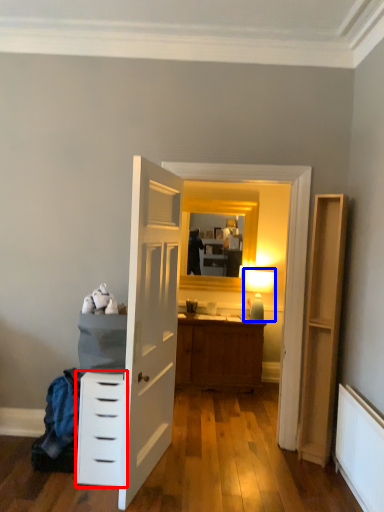
Question: Which object is further to the camera taking this photo, chest of drawers (highlighted by a red box) or light fixture (highlighted by a blue box)?

Choices:
 (A) chest of drawers
 (B) light fixture

Answer: (B)